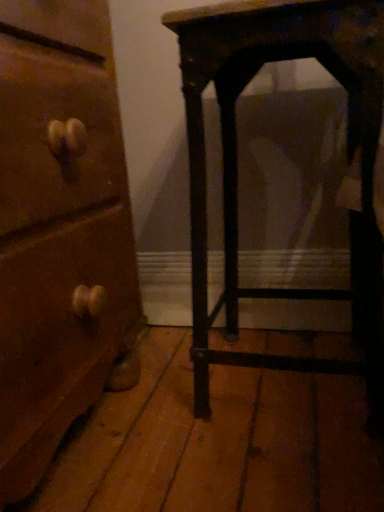
Where is `unoccupied region to the right of wooden chest of drawers at left`? The height and width of the screenshot is (512, 384). unoccupied region to the right of wooden chest of drawers at left is located at coordinates 220,438.